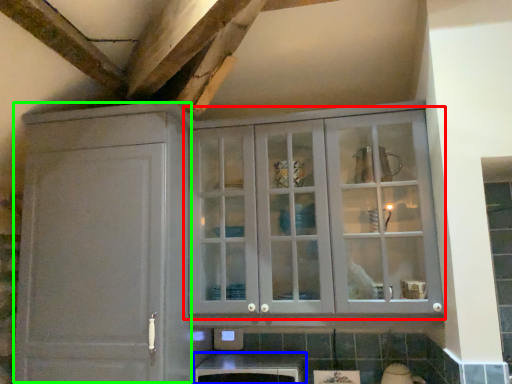
Question: Which object is the closest to the cupboard (highlighted by a red box)? Choose among these: cabinetry (highlighted by a blue box) or cabinetry (highlighted by a green box).

Choices:
 (A) cabinetry
 (B) cabinetry

Answer: (B)